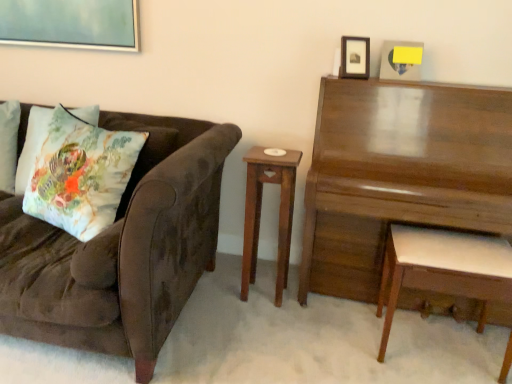
You are a GUI agent. You are given a task and a screenshot of the screen. Output one action in this format:
    pyautogui.click(x=<x>, y=<y>)
    Task: Click on the vacant region above wooden nightstand at center (from a real-world perspective)
    
    Given the screenshot: What is the action you would take?
    pyautogui.click(x=276, y=153)